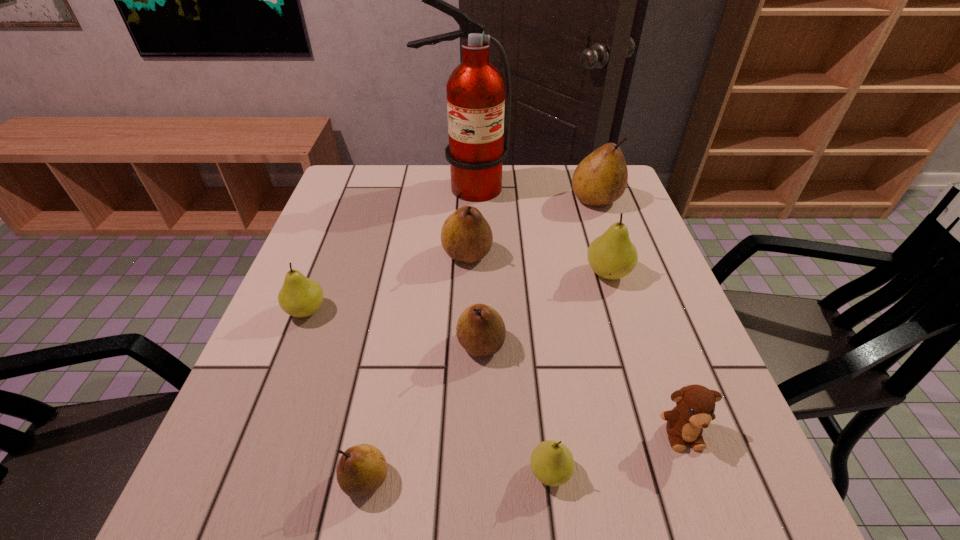
At what (x,y) coordinates should I click in order to perform the action: click on the tallest object. Please return your answer as a coordinate pair (x, y). This screenshot has height=540, width=960. Looking at the image, I should click on (475, 90).

This screenshot has width=960, height=540. Find the location of `the farthest brown pear`. the farthest brown pear is located at coordinates (601, 178).

Find the location of `the tallest pear`. the tallest pear is located at coordinates (601, 178).

In order to click on the second biggest brown pear in this screenshot , I will do `click(466, 236)`.

At what (x,y) coordinates should I click in order to perform the action: click on the rightmost green pear. Please return your answer as a coordinate pair (x, y). This screenshot has height=540, width=960. Looking at the image, I should click on (612, 256).

Find the location of a particular element. the farthest green pear is located at coordinates (612, 256).

The height and width of the screenshot is (540, 960). I want to click on the second smallest green pear, so click(x=299, y=296).

Where is `the leftmost pear`? The width and height of the screenshot is (960, 540). the leftmost pear is located at coordinates (299, 296).

This screenshot has width=960, height=540. I want to click on the second nearest brown pear, so click(480, 330).

Locate an element on the screen. The width and height of the screenshot is (960, 540). brown teddy bear is located at coordinates (695, 408).